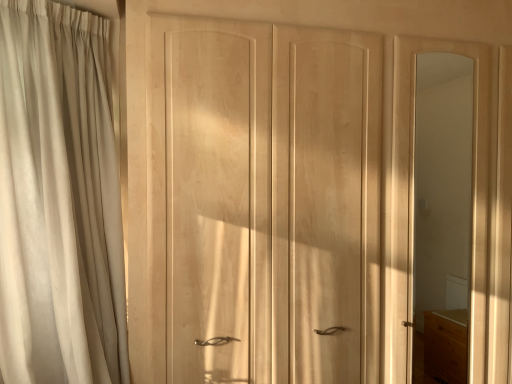
Question: Is the depth of beige fabric curtain at left greater than that of matte wood mirror at right?

Choices:
 (A) yes
 (B) no

Answer: (B)

Question: From the image's perspective, is beige fabric curtain at left located above matte wood mirror at right?

Choices:
 (A) yes
 (B) no

Answer: (A)

Question: Is beige fabric curtain at left aimed at matte wood mirror at right?

Choices:
 (A) yes
 (B) no

Answer: (B)

Question: Is beige fabric curtain at left not close to matte wood mirror at right?

Choices:
 (A) no
 (B) yes

Answer: (B)

Question: Considering the relative sizes of beige fabric curtain at left and matte wood mirror at right in the image provided, is beige fabric curtain at left shorter than matte wood mirror at right?

Choices:
 (A) no
 (B) yes

Answer: (B)

Question: Does beige fabric curtain at left have a lesser width compared to matte wood mirror at right?

Choices:
 (A) no
 (B) yes

Answer: (A)

Question: From a real-world perspective, is natural wood wardrobe at center physically below matte wood mirror at right?

Choices:
 (A) no
 (B) yes

Answer: (A)

Question: Is natural wood wardrobe at center taller than matte wood mirror at right?

Choices:
 (A) yes
 (B) no

Answer: (B)

Question: Can you confirm if natural wood wardrobe at center is smaller than matte wood mirror at right?

Choices:
 (A) yes
 (B) no

Answer: (B)

Question: Is natural wood wardrobe at center wider than matte wood mirror at right?

Choices:
 (A) no
 (B) yes

Answer: (B)

Question: Would you say natural wood wardrobe at center is outside matte wood mirror at right?

Choices:
 (A) yes
 (B) no

Answer: (A)

Question: Is matte wood mirror at right surrounded by natural wood wardrobe at center?

Choices:
 (A) yes
 (B) no

Answer: (B)

Question: Is the position of beige fabric curtain at left less distant than that of natural wood wardrobe at center?

Choices:
 (A) yes
 (B) no

Answer: (A)